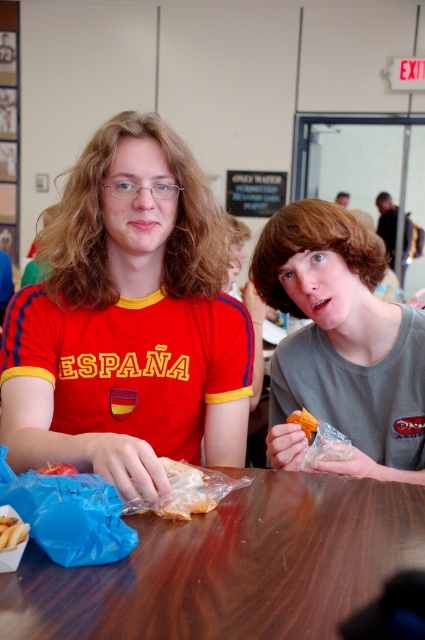
Question: Estimate the real-world distances between objects in this image. Which object is farther from the wooden table at center?

Choices:
 (A) orange crumbly snack at center
 (B) matte red shirt at center
 (C) matte gray shirt at center

Answer: (C)

Question: Can you confirm if matte gray shirt at center is positioned to the left of orange crumbly snack at center?

Choices:
 (A) yes
 (B) no

Answer: (B)

Question: Is golden crispy fries at table center above orange crumbly snack at center?

Choices:
 (A) no
 (B) yes

Answer: (A)

Question: Which of the following is the closest to the observer?

Choices:
 (A) orange crumbly snack at center
 (B) matte gray shirt at center

Answer: (B)

Question: Which object is farther from the camera taking this photo?

Choices:
 (A) matte gray shirt at center
 (B) orange crumbly snack at center
 (C) matte red shirt at center
 (D) golden crispy fries at table center

Answer: (B)

Question: Can you confirm if golden crispy fries at table center is bigger than translucent plastic bag at table center?

Choices:
 (A) no
 (B) yes

Answer: (A)